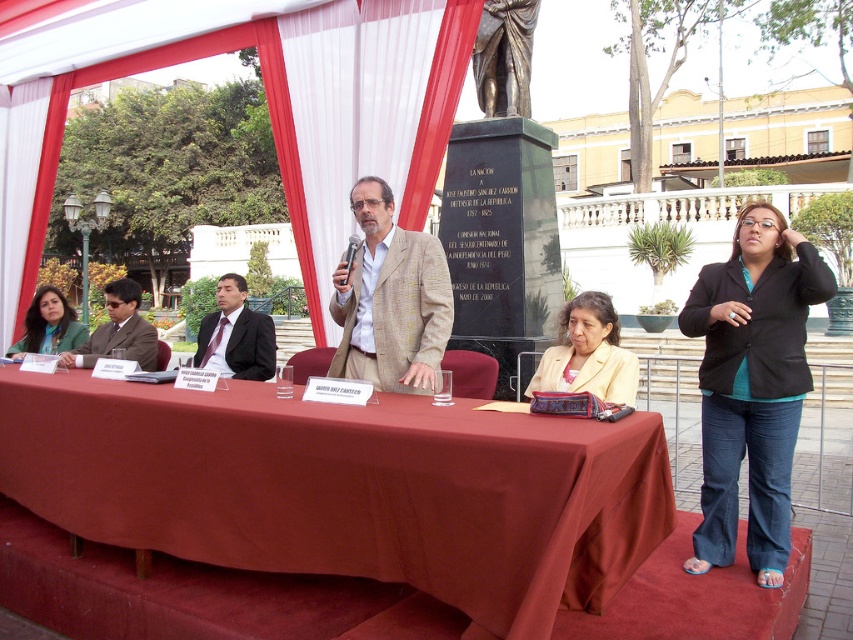
Question: Based on their relative distances, which object is nearer to the green fabric jacket at left?

Choices:
 (A) dark suit at center
 (B) maroon fabric table at center
 (C) white striped curtain at upper center

Answer: (A)

Question: Is light yellow fabric jacket at center below dark suit at center?

Choices:
 (A) no
 (B) yes

Answer: (A)

Question: Is beige textured blazer at center to the left of matte brown suit at left from the viewer's perspective?

Choices:
 (A) yes
 (B) no

Answer: (B)

Question: Estimate the real-world distances between objects in this image. Which object is closer to the white striped curtain at upper center?

Choices:
 (A) matte brown suit at left
 (B) maroon fabric table at center
 (C) green fabric jacket at left
 (D) beige textured blazer at center

Answer: (D)

Question: Is dark suit at center in front of matte brown suit at left?

Choices:
 (A) yes
 (B) no

Answer: (B)

Question: Which of the following is the farthest from the observer?

Choices:
 (A) (225, 289)
 (B) (108, 284)
 (C) (258, 40)
 (D) (560, 371)

Answer: (B)